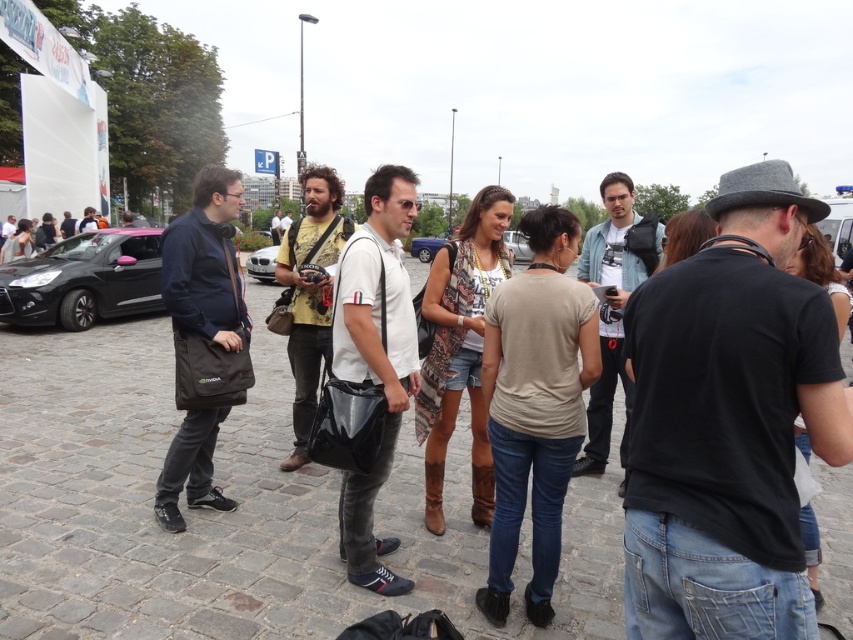
Question: Can you confirm if dark blue fabric jacket at left is wider than denim jacket at center?

Choices:
 (A) no
 (B) yes

Answer: (B)

Question: Does dark blue fabric jacket at left appear under white matte bag at center?

Choices:
 (A) yes
 (B) no

Answer: (B)

Question: Which object is positioned closest to the silver metallic car at center?

Choices:
 (A) dark brown leather jacket at center
 (B) yellow printed shirt at center

Answer: (A)

Question: Does white matte bag at center appear over dark brown leather jacket at center?

Choices:
 (A) yes
 (B) no

Answer: (B)

Question: Which of the following is the closest to the observer?

Choices:
 (A) (334, 218)
 (B) (523, 248)
 (C) (210, 273)
 (D) (4, 284)

Answer: (C)

Question: Which point is farther from the camera taking this photo?

Choices:
 (A) (428, 259)
 (B) (294, 252)
 (C) (281, 225)
 (D) (198, 253)

Answer: (A)